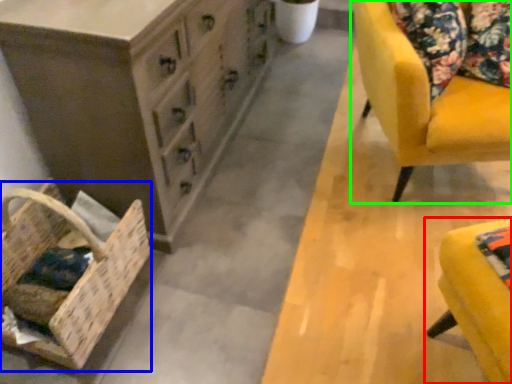
Question: Estimate the real-world distances between objects in this image. Which object is farther from furniture (highlighted by a red box), basket (highlighted by a blue box) or chair (highlighted by a green box)?

Choices:
 (A) basket
 (B) chair

Answer: (A)